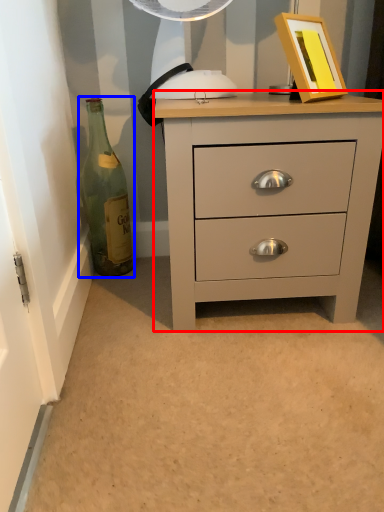
Question: Which of the following is the farthest to the observer, chest of drawers (highlighted by a red box) or bottle (highlighted by a blue box)?

Choices:
 (A) chest of drawers
 (B) bottle

Answer: (B)